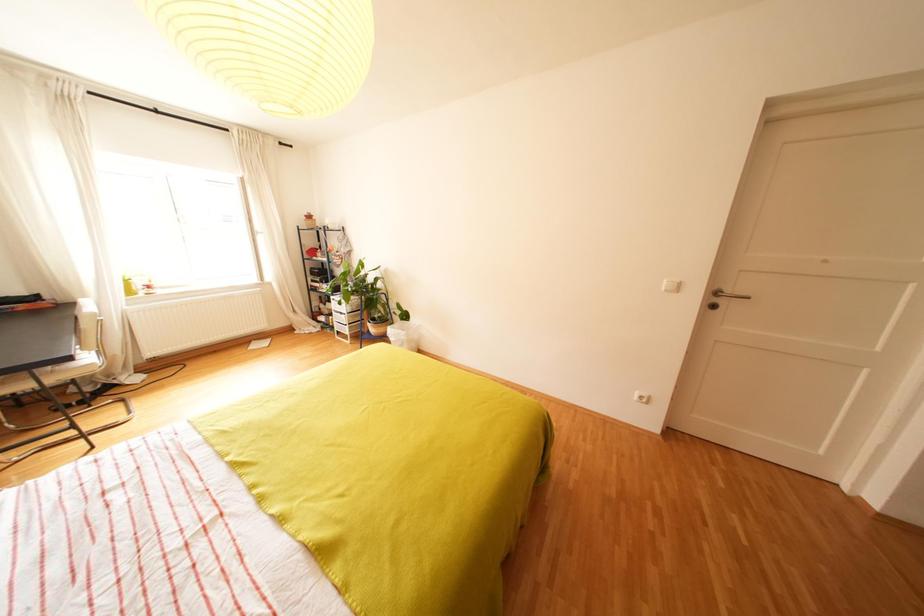
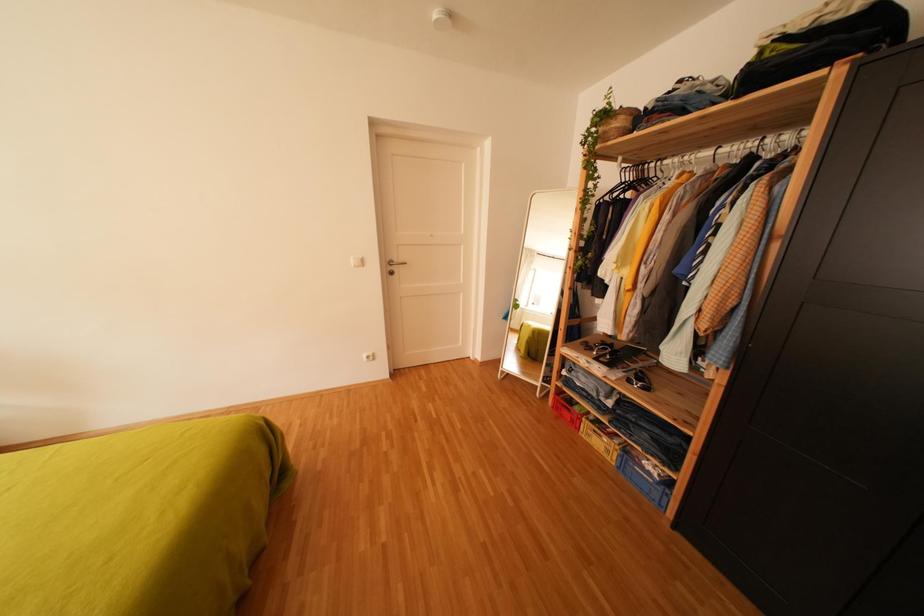
Question: The camera is either moving clockwise (left) or counter-clockwise (right) around the object. The first image is from the beginning of the video and the second image is from the end. Is the camera moving left or right when shooting the video?

Choices:
 (A) Left
 (B) Right

Answer: (A)